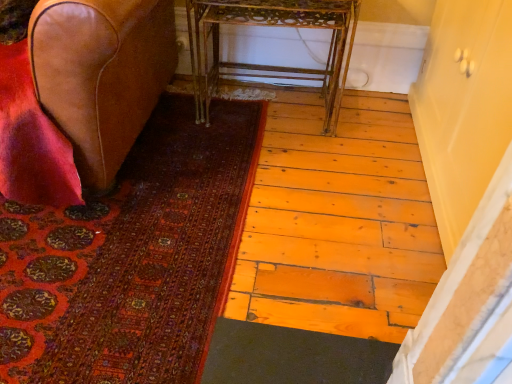
Question: Can you confirm if metallic gold table at center is taller than leather at left?

Choices:
 (A) no
 (B) yes

Answer: (A)

Question: Can you confirm if metallic gold table at center is thinner than leather at left?

Choices:
 (A) no
 (B) yes

Answer: (B)

Question: Is metallic gold table at center at the right side of leather at left?

Choices:
 (A) yes
 (B) no

Answer: (A)

Question: Does metallic gold table at center turn towards leather at left?

Choices:
 (A) no
 (B) yes

Answer: (A)

Question: Does metallic gold table at center come behind leather at left?

Choices:
 (A) yes
 (B) no

Answer: (A)

Question: Does metallic gold table at center touch leather at left?

Choices:
 (A) no
 (B) yes

Answer: (A)

Question: Considering the relative positions of carpeted mat at lower left and metallic gold table at center in the image provided, is carpeted mat at lower left to the right of metallic gold table at center from the viewer's perspective?

Choices:
 (A) yes
 (B) no

Answer: (B)

Question: Is carpeted mat at lower left bigger than metallic gold table at center?

Choices:
 (A) no
 (B) yes

Answer: (A)

Question: Is carpeted mat at lower left positioned in front of metallic gold table at center?

Choices:
 (A) no
 (B) yes

Answer: (B)

Question: Can you confirm if carpeted mat at lower left is thinner than metallic gold table at center?

Choices:
 (A) yes
 (B) no

Answer: (B)

Question: Does carpeted mat at lower left have a smaller size compared to metallic gold table at center?

Choices:
 (A) no
 (B) yes

Answer: (B)

Question: Would you consider carpeted mat at lower left to be distant from metallic gold table at center?

Choices:
 (A) yes
 (B) no

Answer: (B)

Question: From the image's perspective, does leather at left appear higher than metallic gold table at center?

Choices:
 (A) yes
 (B) no

Answer: (B)